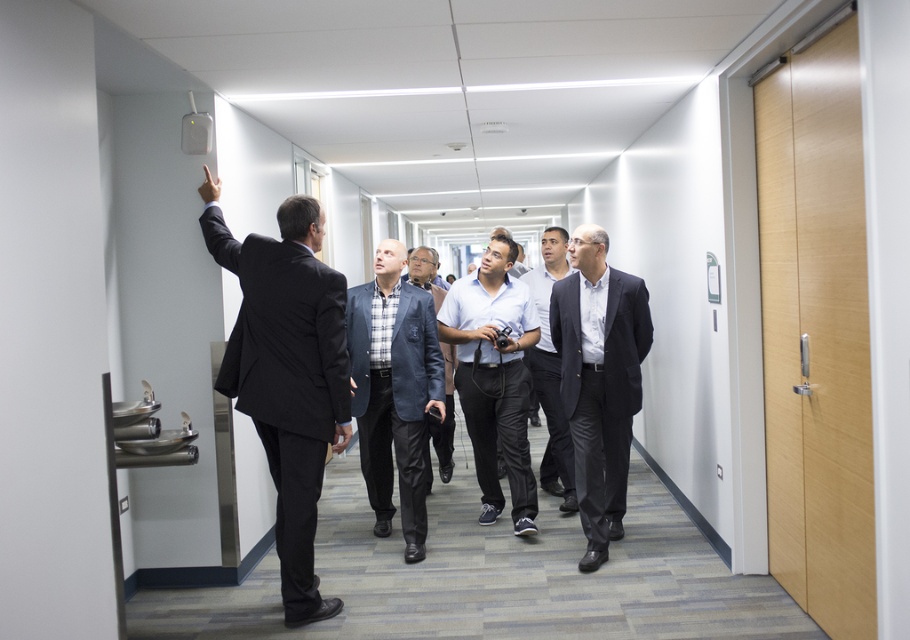
You are a visitor in the office hallway and see two points marked on the wall. The first point is at coordinate point (231,264) and the second is at point (506,250). Which point is closer to your eyes?

Point (231,264) is closer to the camera than point (506,250).

You are a delivery person carrying a box that is 2 meters long. You are in the hallway and need to pass between the light brown wood elevator at right and the blue textured blazer at center. Is there enough space for your box to fit through?

The light brown wood elevator at right and blue textured blazer at center are 2.09 meters apart, so the 2 meter long box can fit through the space between them since the distance is slightly larger than the box.

You are a delivery person carrying a large box that is 1.2 meters wide. You need to pass through the hallway and go to the elevator. Can you fit through the space next to the blue textured blazer at center to reach the light brown wood elevator at right?

The light brown wood elevator at right has a width less than the blue textured blazer at center, so the space next to the blue textured blazer at center is likely wide enough for your 1.2 meter box to pass through to reach the elevator.